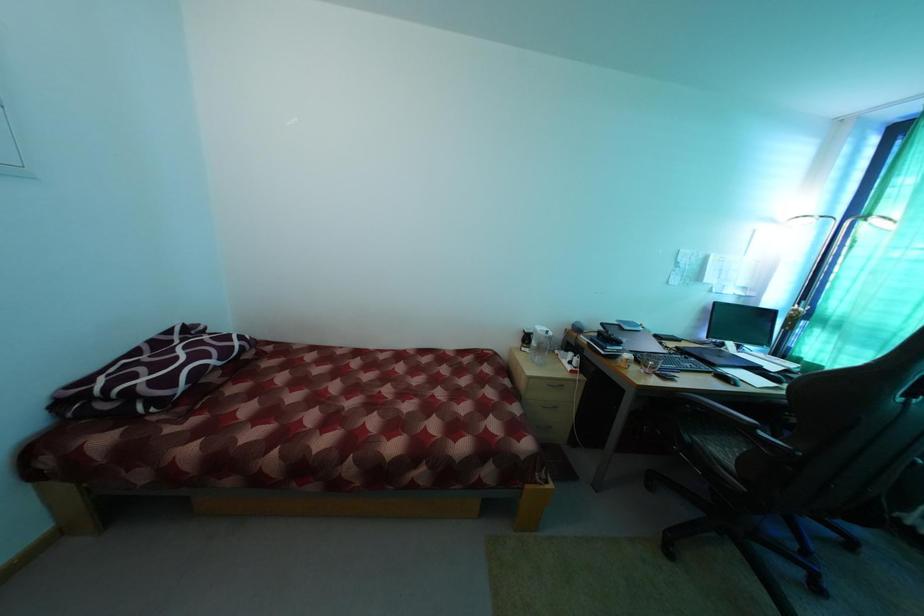
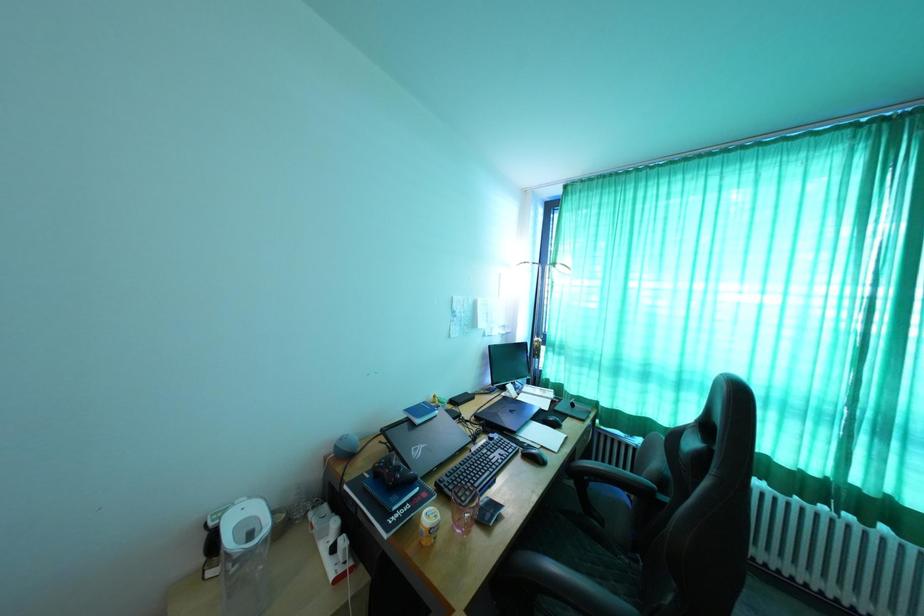
Question: The camera is either moving clockwise (left) or counter-clockwise (right) around the object. The first image is from the beginning of the video and the second image is from the end. Is the camera moving left or right when shooting the video?

Choices:
 (A) Left
 (B) Right

Answer: (A)